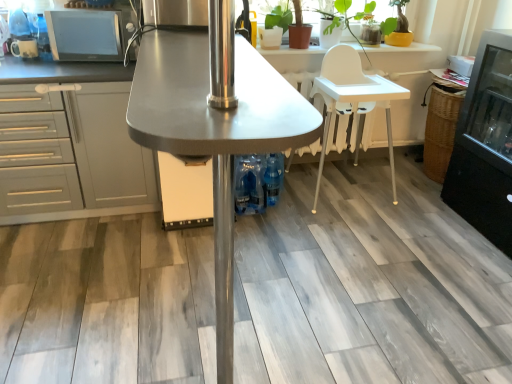
You are a GUI agent. You are given a task and a screenshot of the screen. Output one action in this format:
    pyautogui.click(x=<x>, y=<y>)
    Task: Click on the free space in front of white plastic chair at center
    Image resolution: width=512 pixels, height=384 pixels.
    Given the screenshot: What is the action you would take?
    pyautogui.click(x=322, y=235)